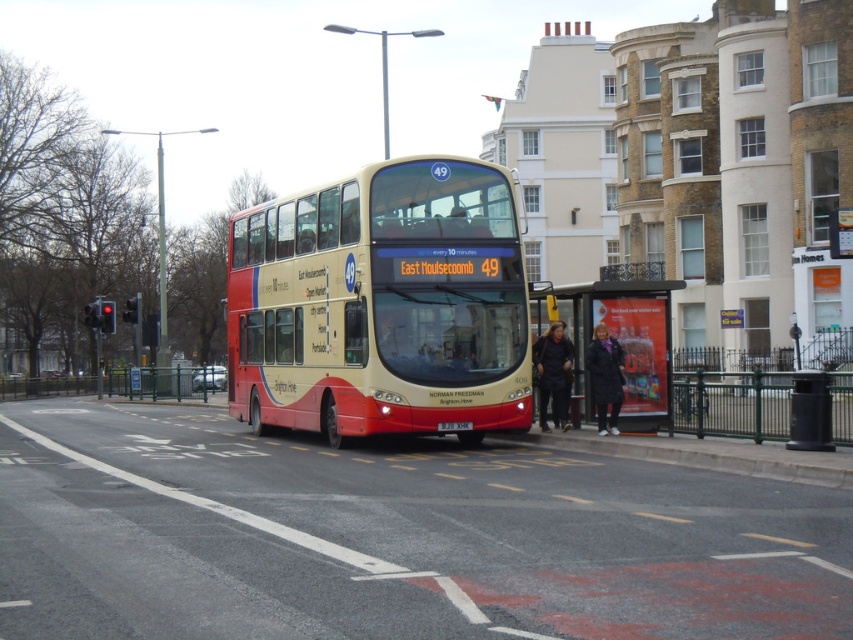
Question: Which object is the farthest from the beige/red painted double-decker bus at center?

Choices:
 (A) black plastic license plate at center
 (B) dark blue fabric coat at center
 (C) dark purple fabric coat at right
 (D) matte plastic bus stop at center

Answer: (D)

Question: Does dark blue fabric coat at center appear on the right side of dark purple fabric coat at right?

Choices:
 (A) no
 (B) yes

Answer: (A)

Question: Is beige/red painted double-decker bus at center to the left of matte plastic bus stop at center from the viewer's perspective?

Choices:
 (A) no
 (B) yes

Answer: (B)

Question: Which object is the farthest from the black plastic license plate at center?

Choices:
 (A) matte plastic bus stop at center
 (B) dark blue fabric coat at center
 (C) dark purple fabric coat at right

Answer: (A)

Question: Does beige/red painted double-decker bus at center come behind matte plastic bus stop at center?

Choices:
 (A) yes
 (B) no

Answer: (B)

Question: Which object appears closest to the camera in this image?

Choices:
 (A) dark blue fabric coat at center
 (B) black plastic license plate at center
 (C) beige/red painted double-decker bus at center

Answer: (C)